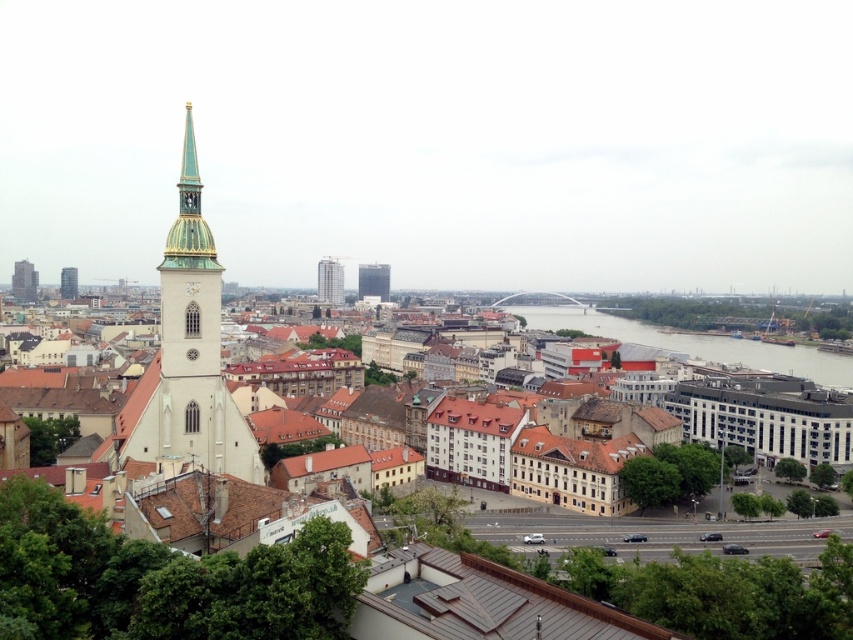
Question: Which of these objects is positioned farthest from the dark gray glass tower at upper left?

Choices:
 (A) metallic glass tower at center
 (B) matte white tower at left

Answer: (A)

Question: Is metallic glass tower at center wider than dark gray glass tower at upper left?

Choices:
 (A) yes
 (B) no

Answer: (B)

Question: Which of the following is the farthest from the observer?

Choices:
 (A) (71, 269)
 (B) (335, 280)

Answer: (A)

Question: Can you confirm if clear glass waterway at center is positioned to the right of matte glass skyscraper at center?

Choices:
 (A) no
 (B) yes

Answer: (B)

Question: Which of the following is the farthest from the observer?

Choices:
 (A) matte glass skyscraper at center
 (B) metallic glass tower at center

Answer: (A)

Question: Can you confirm if white stone tower at left is thinner than matte glass skyscraper at center?

Choices:
 (A) yes
 (B) no

Answer: (B)